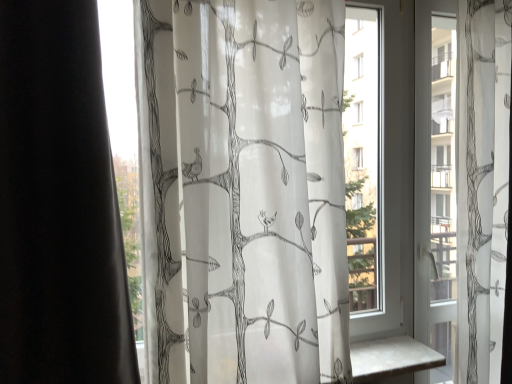
Question: Would you say transparent glass window at right is inside or outside translucent white fabric at center?

Choices:
 (A) outside
 (B) inside

Answer: (A)

Question: From their relative heights in the image, would you say transparent glass window at right is taller or shorter than translucent white fabric at center?

Choices:
 (A) tall
 (B) short

Answer: (A)

Question: Is transparent glass window at right in front of or behind translucent white fabric at center in the image?

Choices:
 (A) behind
 (B) front

Answer: (A)

Question: From the image's perspective, is translucent white fabric at center above or below transparent glass window at right?

Choices:
 (A) above
 (B) below

Answer: (B)

Question: Relative to transparent glass window at right, is translucent white fabric at center in front or behind?

Choices:
 (A) behind
 (B) front

Answer: (B)

Question: From a real-world perspective, is translucent white fabric at center positioned above or below transparent glass window at right?

Choices:
 (A) below
 (B) above

Answer: (B)

Question: In the image, is translucent white fabric at center on the left side or the right side of transparent glass window at right?

Choices:
 (A) left
 (B) right

Answer: (A)